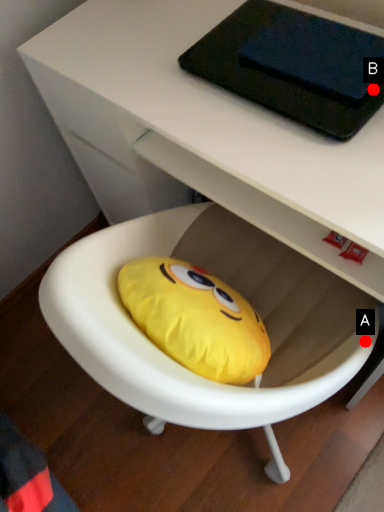
Question: Two points are circled on the image, labeled by A and B beside each circle. Which point is farther to the camera?

Choices:
 (A) A is further
 (B) B is further

Answer: (A)